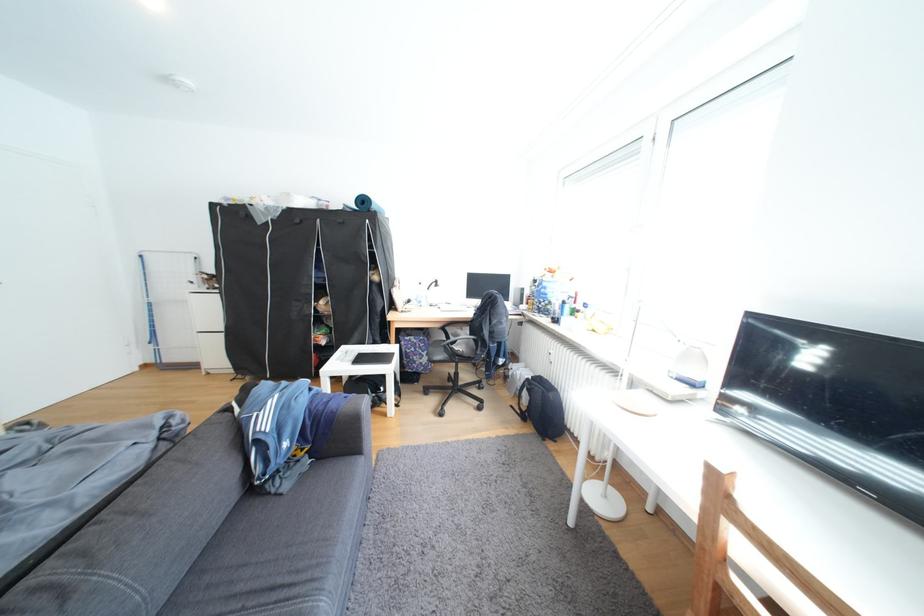
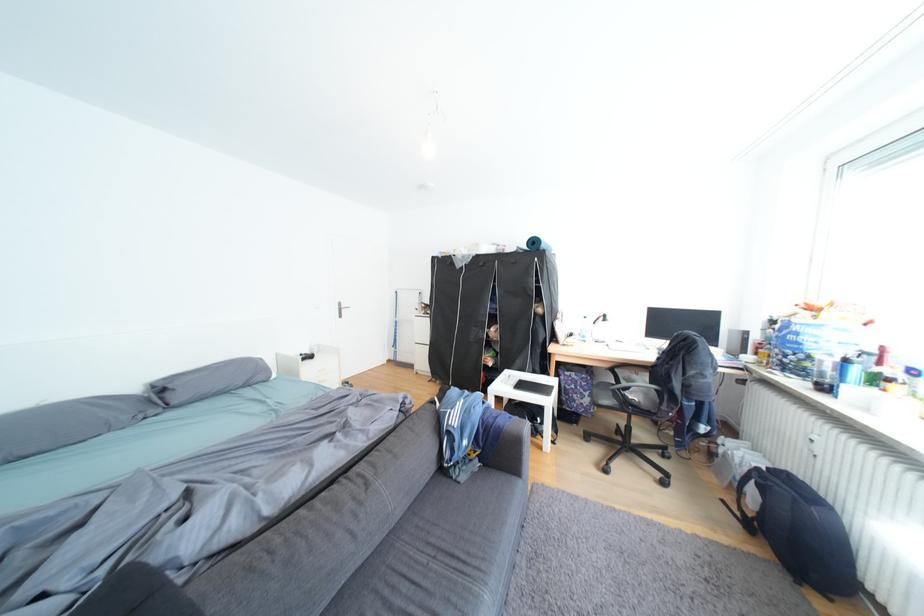
Where in the second image is the point corresponding to the point at 460,345 from the first image?

(631, 390)